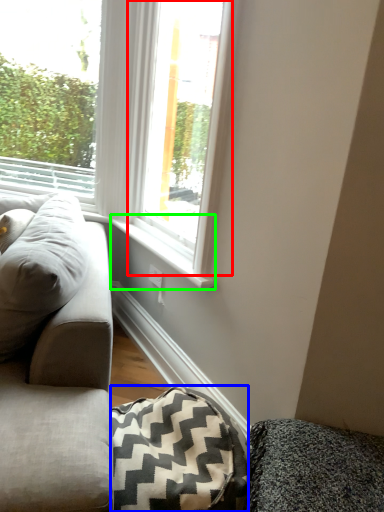
Question: Which object is the closest to the window (highlighted by a red box)? Choose among these: blanket (highlighted by a blue box) or window sill (highlighted by a green box).

Choices:
 (A) blanket
 (B) window sill

Answer: (B)